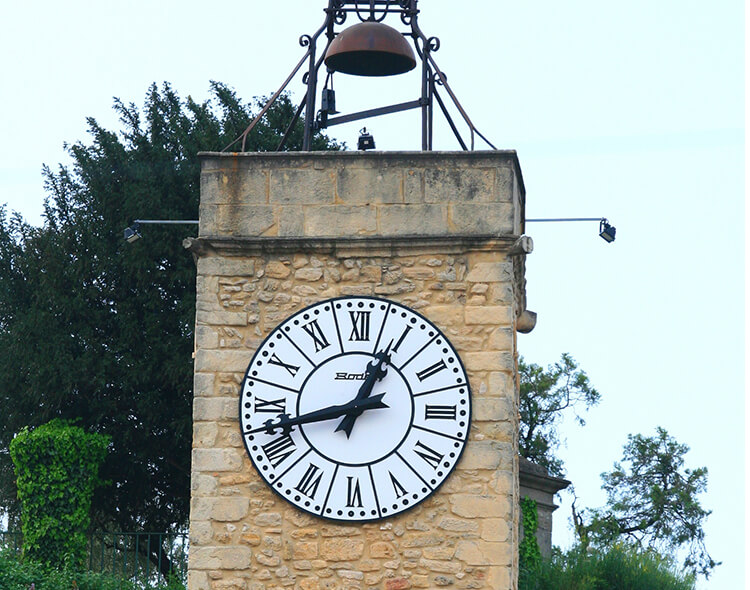
Find the location of a particular element. The height and width of the screenshot is (590, 750). clock is located at coordinates (390, 431).